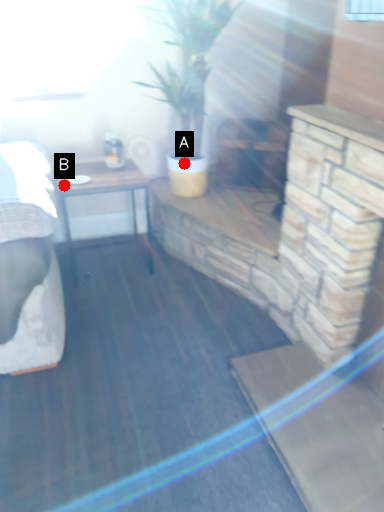
Question: Two points are circled on the image, labeled by A and B beside each circle. Which of the following is the farthest from the observer?

Choices:
 (A) A is further
 (B) B is further

Answer: (A)